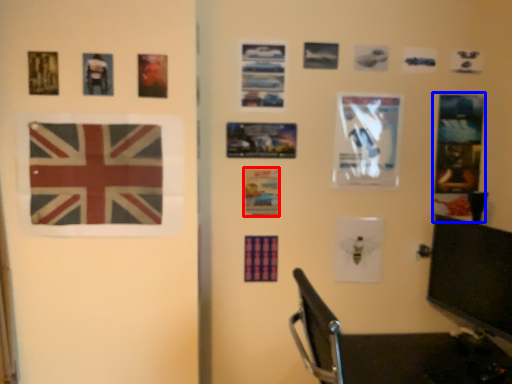
Question: Which object appears closest to the camera in this image, postcard (highlighted by a red box) or postcard (highlighted by a blue box)?

Choices:
 (A) postcard
 (B) postcard

Answer: (A)